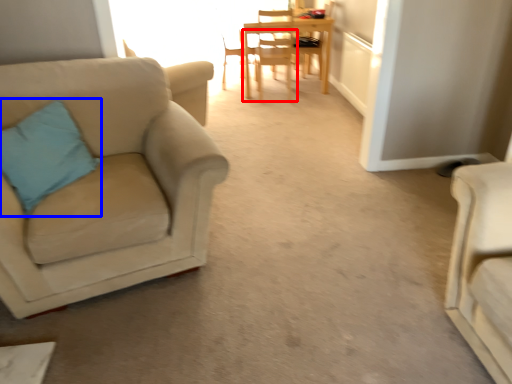
Question: Among these objects, which one is farthest to the camera, chair (highlighted by a red box) or pillow (highlighted by a blue box)?

Choices:
 (A) chair
 (B) pillow

Answer: (A)